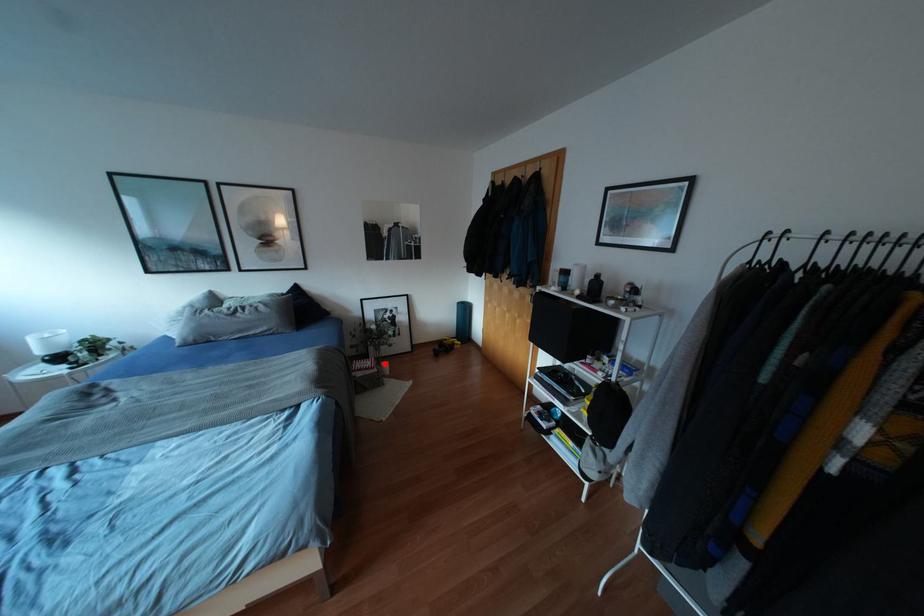
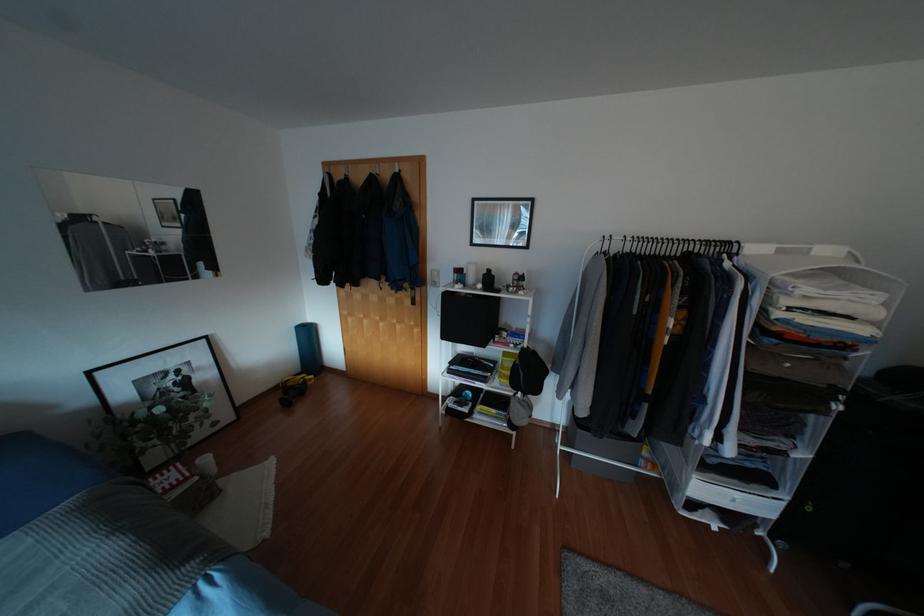
Question: I am providing you with two images of the same scene from different viewpoints. In image1, a red point is highlighted. Considering the same 3D point in image2, which of the following is correct?

Choices:
 (A) It is closer
 (B) It is farther

Answer: (B)